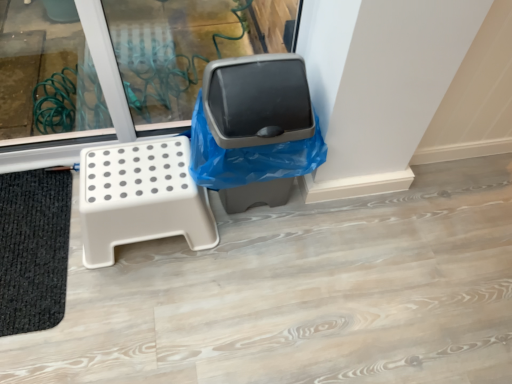
Where is `vacant area located to the right-hand side of black textured bath mat at lower left`? This screenshot has height=384, width=512. vacant area located to the right-hand side of black textured bath mat at lower left is located at coordinates (140, 290).